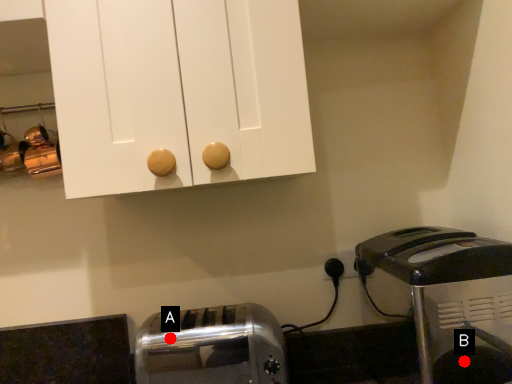
Question: Two points are circled on the image, labeled by A and B beside each circle. Which point is farther from the camera taking this photo?

Choices:
 (A) A is further
 (B) B is further

Answer: (A)